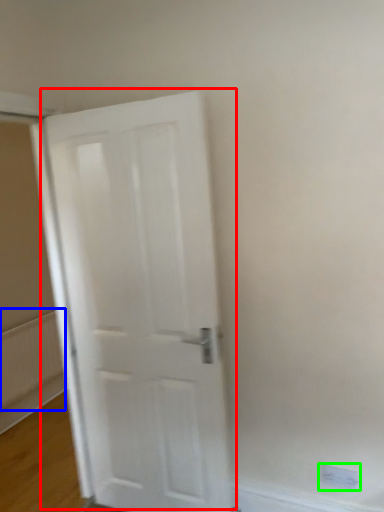
Question: Which is nearer to the door (highlighted by a red box)? radiator (highlighted by a blue box) or electric outlet (highlighted by a green box).

Choices:
 (A) radiator
 (B) electric outlet

Answer: (B)